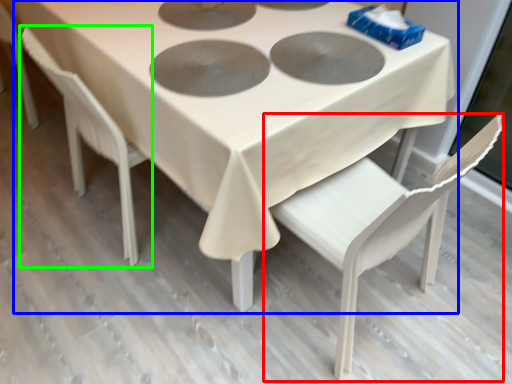
Question: Which object is the closest to the chair (highlighted by a red box)? Choose among these: table (highlighted by a blue box) or chair (highlighted by a green box).

Choices:
 (A) table
 (B) chair

Answer: (A)